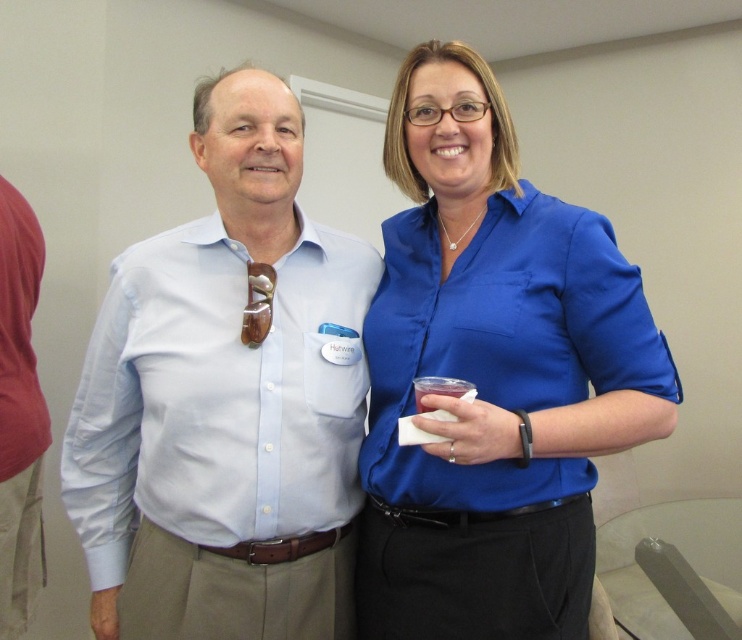
Which of these two, blue satin blouse at center or light blue cotton shirt at center, stands shorter?

With less height is light blue cotton shirt at center.

Is blue satin blouse at center below light blue cotton shirt at center?

No.

This screenshot has height=640, width=742. Describe the element at coordinates (492, 376) in the screenshot. I see `blue satin blouse at center` at that location.

This screenshot has height=640, width=742. Identify the location of blue satin blouse at center. (492, 376).